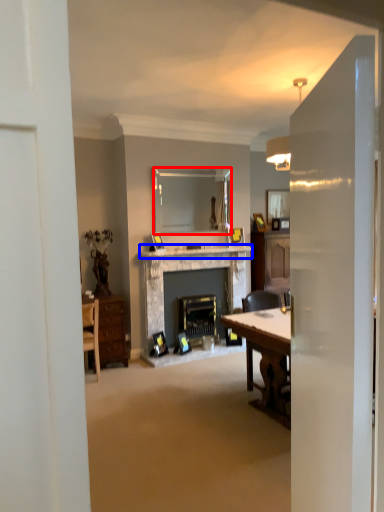
Question: Which point is further to the camera, mirror (highlighted by a red box) or mantle (highlighted by a blue box)?

Choices:
 (A) mirror
 (B) mantle

Answer: (A)